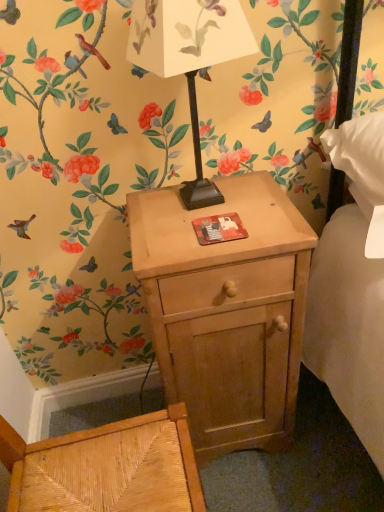
Locate an element on the screen. The width and height of the screenshot is (384, 512). free location in front of matte black table lamp at center is located at coordinates (203, 247).